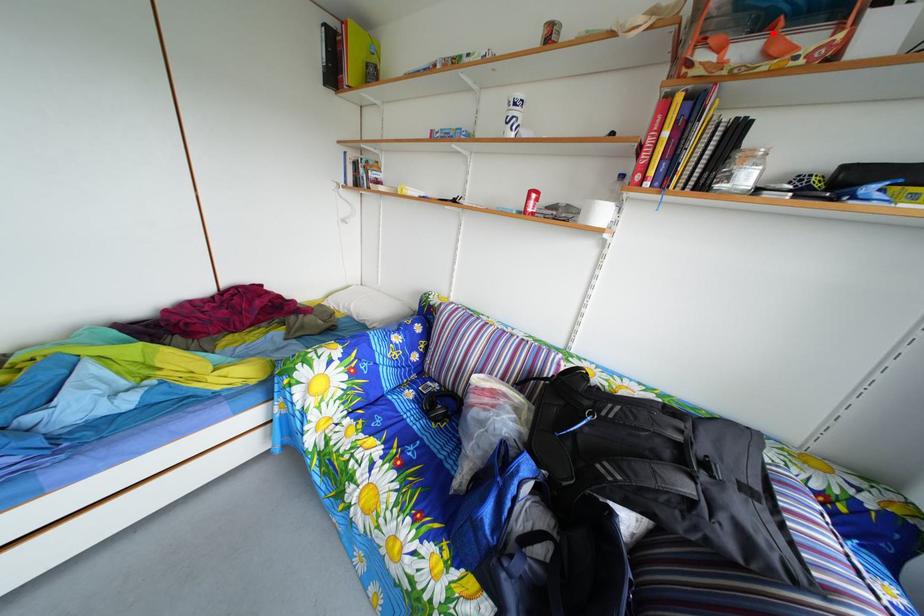
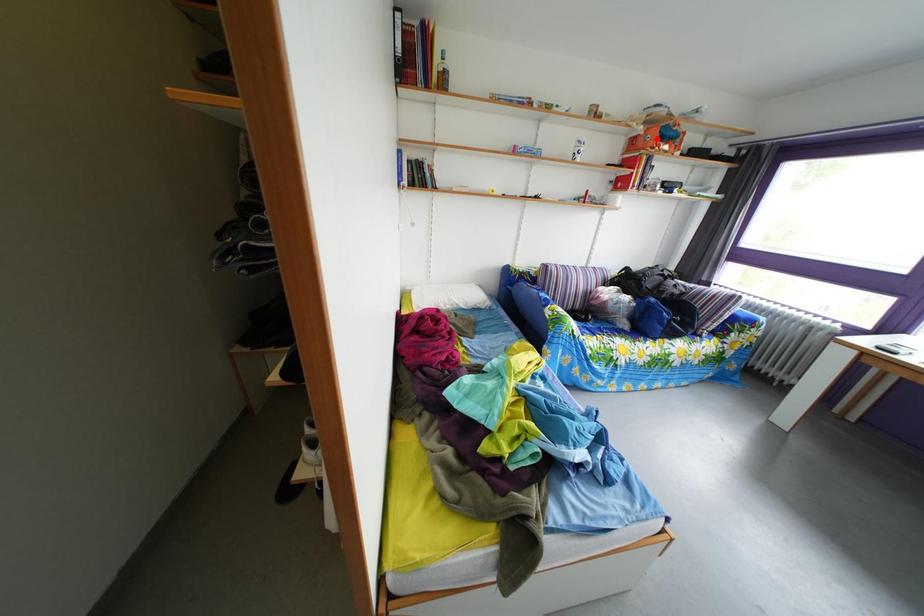
I am providing you with two images of the same scene from different viewpoints. A red point is marked on the first image and another point is marked on the second image. Do the highlighted points in image1 and image2 indicate the same real-world spot?

No